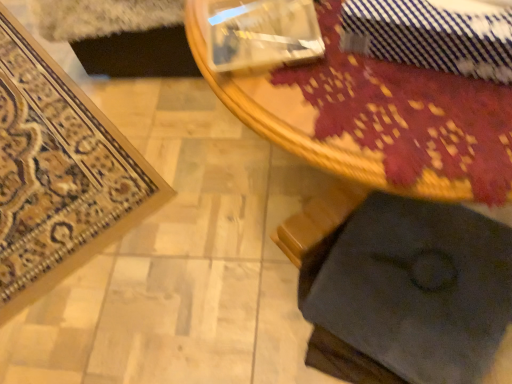
Question: From the image's perspective, is wooden table at center above or below dark fabric cushion at lower right?

Choices:
 (A) above
 (B) below

Answer: (A)

Question: From a real-world perspective, is wooden table at center positioned above or below dark fabric cushion at lower right?

Choices:
 (A) above
 (B) below

Answer: (A)

Question: Considering the real-world distances, which object is closest to the carpeted mat at lower left?

Choices:
 (A) blue striped tie at upper right
 (B) dark fabric cushion at lower right
 (C) wooden table at center

Answer: (B)

Question: Which of these objects is positioned closest to the dark fabric cushion at lower right?

Choices:
 (A) wooden table at center
 (B) blue striped tie at upper right
 (C) carpeted mat at lower left

Answer: (A)